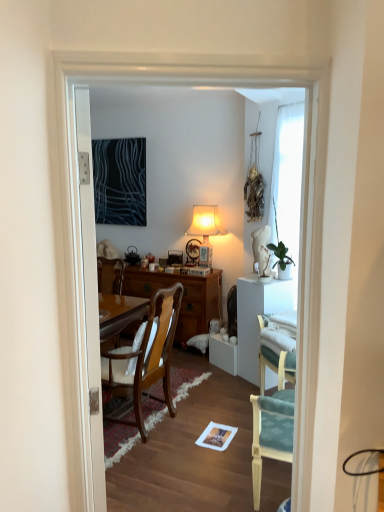
Image resolution: width=384 pixels, height=512 pixels. Identify the location of white glossy door at left. (90, 294).

What do you see at coordinates (282, 260) in the screenshot?
I see `green glossy houseplant at upper right` at bounding box center [282, 260].

At what (x,y) coordinates should I click in order to perform the action: click on green glossy houseplant at upper right. Please return your answer as a coordinate pair (x, y). Image resolution: width=384 pixels, height=512 pixels. Looking at the image, I should click on (282, 260).

Find the location of a particular element. The width and height of the screenshot is (384, 512). teal fabric chair at right, placed as the 1th chair when sorted from front to back is located at coordinates (272, 416).

Image resolution: width=384 pixels, height=512 pixels. What do you see at coordinates (120, 181) in the screenshot?
I see `dark blue fabric at upper left` at bounding box center [120, 181].

Where is `white glossy door at left`? white glossy door at left is located at coordinates (90, 294).

Considering the relative positions of wooden chair with cushion at center, the second chair viewed from the right, and teal fabric chair at right, which is the first chair in right-to-left order, in the image provided, is wooden chair with cushion at center, the second chair viewed from the right, in front of teal fabric chair at right, which is the first chair in right-to-left order,?

No, wooden chair with cushion at center, the second chair viewed from the right, is further to the viewer.

From the image's perspective, is wooden chair with cushion at center, the first chair when ordered from back to front, located above or below teal fabric chair at right, placed as the 1th chair when sorted from front to back?

From the image's perspective, wooden chair with cushion at center, the first chair when ordered from back to front, appears above teal fabric chair at right, placed as the 1th chair when sorted from front to back.

Based on the photo, between wooden chair with cushion at center, the first chair when ordered from back to front, and teal fabric chair at right, placed as the 2th chair when sorted from left to right, which one has larger size?

wooden chair with cushion at center, the first chair when ordered from back to front.

Find the location of a particular element. The image size is (384, 512). chair below the wooden chair with cushion at center, the second chair viewed from the right (from a real-world perspective) is located at coordinates (272, 416).

Is teal fabric chair at right, the second chair positioned from the back, positioned with its back to wooden chair with cushion at center, which is the 2th chair from front to back?

No.

From the image's perspective, relative to wooden chair with cushion at center, which is the 1th chair in left-to-right order, is teal fabric chair at right, which is the first chair in right-to-left order, above or below?

From the image's perspective, teal fabric chair at right, which is the first chair in right-to-left order, appears below wooden chair with cushion at center, which is the 1th chair in left-to-right order.

Considering the relative sizes of teal fabric chair at right, placed as the 1th chair when sorted from front to back, and wooden chair with cushion at center, which is the 1th chair in left-to-right order, in the image provided, is teal fabric chair at right, placed as the 1th chair when sorted from front to back, smaller than wooden chair with cushion at center, which is the 1th chair in left-to-right order,?

Yes, teal fabric chair at right, placed as the 1th chair when sorted from front to back, is smaller than wooden chair with cushion at center, which is the 1th chair in left-to-right order.

Is green glossy houseplant at upper right positioned with its back to wooden chair with cushion at center, the second chair viewed from the right?

No.

I want to click on houseplant behind the wooden chair with cushion at center, which is the 2th chair from front to back, so [282, 260].

From a real-world perspective, which is physically below, green glossy houseplant at upper right or wooden chair with cushion at center, which is the 1th chair in left-to-right order?

wooden chair with cushion at center, which is the 1th chair in left-to-right order, is physically lower.

Is green glossy houseplant at upper right far away from wooden chair with cushion at center, the first chair when ordered from back to front?

green glossy houseplant at upper right is far away from wooden chair with cushion at center, the first chair when ordered from back to front.

Which is behind, point (112, 193) or point (281, 242)?

The point (112, 193) is farther from the camera.

Is dark blue fabric at upper left bigger or smaller than green glossy houseplant at upper right?

Considering their sizes, dark blue fabric at upper left takes up more space than green glossy houseplant at upper right.

Between dark blue fabric at upper left and green glossy houseplant at upper right, which one has larger width?

green glossy houseplant at upper right.

From a real-world perspective, does green glossy houseplant at upper right stand above teal fabric chair at right, placed as the 1th chair when sorted from front to back?

Yes.

From the image's perspective, is green glossy houseplant at upper right over teal fabric chair at right, placed as the 1th chair when sorted from front to back?

Yes, from the image's perspective, green glossy houseplant at upper right is over teal fabric chair at right, placed as the 1th chair when sorted from front to back.

You are a GUI agent. You are given a task and a screenshot of the screen. Output one action in this format:
    pyautogui.click(x=<x>, y=<y>)
    Task: Click on the houseplant located above the teal fabric chair at right, placed as the 2th chair when sorted from left to right (from a real-world perspective)
    The image size is (384, 512).
    Given the screenshot: What is the action you would take?
    pyautogui.click(x=282, y=260)

Is green glossy houseplant at upper right at the left side of teal fabric chair at right, which is the first chair in right-to-left order?

No.

From the image's perspective, which object appears higher, green glossy houseplant at upper right or white glossy door at left?

green glossy houseplant at upper right.

Is green glossy houseplant at upper right far away from white glossy door at left?

green glossy houseplant at upper right is far away from white glossy door at left.

Looking at this image, from a real-world perspective, is white glossy door at left on top of teal fabric chair at right, the second chair positioned from the back?

Yes, from a real-world perspective, white glossy door at left is on top of teal fabric chair at right, the second chair positioned from the back.

Which object is positioned more to the right, white glossy door at left or teal fabric chair at right, placed as the 1th chair when sorted from front to back?

teal fabric chair at right, placed as the 1th chair when sorted from front to back.

Measure the distance between white glossy door at left and teal fabric chair at right, placed as the 1th chair when sorted from front to back.

They are 36.59 inches apart.

From the image's perspective, which object appears higher, white glossy door at left or teal fabric chair at right, the second chair positioned from the back?

white glossy door at left is shown above in the image.

This screenshot has width=384, height=512. I want to click on chair behind the teal fabric chair at right, placed as the 1th chair when sorted from front to back, so click(145, 357).

Locate an element on the screen. This screenshot has height=512, width=384. chair that appears on the right of wooden chair with cushion at center, which is the 2th chair from front to back is located at coordinates (272, 416).

Based on their spatial positions, is teal fabric chair at right, placed as the 2th chair when sorted from left to right, or wooden chair with cushion at center, the second chair viewed from the right, further from dark blue fabric at upper left?

Based on the image, teal fabric chair at right, placed as the 2th chair when sorted from left to right, appears to be further to dark blue fabric at upper left.

Based on the photo, which object lies further to the anchor point white glossy door at left, teal fabric chair at right, placed as the 1th chair when sorted from front to back, or wooden chair with cushion at center, which is the 2th chair from front to back?

wooden chair with cushion at center, which is the 2th chair from front to back, is further to white glossy door at left.

Based on their spatial positions, is white glossy door at left or dark blue fabric at upper left further from teal fabric chair at right, the second chair positioned from the back?

The object further to teal fabric chair at right, the second chair positioned from the back, is dark blue fabric at upper left.

Estimate the real-world distances between objects in this image. Which object is further from teal fabric chair at right, the second chair positioned from the back, wooden chair with cushion at center, which is the 1th chair in left-to-right order, or dark blue fabric at upper left?

The object further to teal fabric chair at right, the second chair positioned from the back, is dark blue fabric at upper left.

Which object lies further to the anchor point wooden chair with cushion at center, which is the 2th chair from front to back, dark blue fabric at upper left or teal fabric chair at right, placed as the 1th chair when sorted from front to back?

Based on the image, dark blue fabric at upper left appears to be further to wooden chair with cushion at center, which is the 2th chair from front to back.

Based on their spatial positions, is dark blue fabric at upper left or green glossy houseplant at upper right closer to teal fabric chair at right, placed as the 1th chair when sorted from front to back?

green glossy houseplant at upper right is closer to teal fabric chair at right, placed as the 1th chair when sorted from front to back.

Based on their spatial positions, is dark blue fabric at upper left or white glossy door at left closer to wooden chair with cushion at center, which is the 1th chair in left-to-right order?

white glossy door at left lies closer to wooden chair with cushion at center, which is the 1th chair in left-to-right order, than the other object.

Estimate the real-world distances between objects in this image. Which object is closer to green glossy houseplant at upper right, white glossy door at left or dark blue fabric at upper left?

Among the two, dark blue fabric at upper left is located nearer to green glossy houseplant at upper right.

This screenshot has height=512, width=384. I want to click on houseplant positioned between wooden chair with cushion at center, the first chair when ordered from back to front, and dark blue fabric at upper left from near to far, so click(x=282, y=260).

You are a GUI agent. You are given a task and a screenshot of the screen. Output one action in this format:
    pyautogui.click(x=<x>, y=<y>)
    Task: Click on the chair positioned between white glossy door at left and wooden chair with cushion at center, the first chair when ordered from back to front, from near to far
    The image size is (384, 512).
    Given the screenshot: What is the action you would take?
    pyautogui.click(x=272, y=416)

Identify the location of chair located between teal fabric chair at right, the second chair positioned from the back, and green glossy houseplant at upper right in the depth direction. This screenshot has height=512, width=384. (145, 357).

The width and height of the screenshot is (384, 512). I want to click on chair positioned between teal fabric chair at right, placed as the 1th chair when sorted from front to back, and dark blue fabric at upper left from near to far, so click(x=145, y=357).